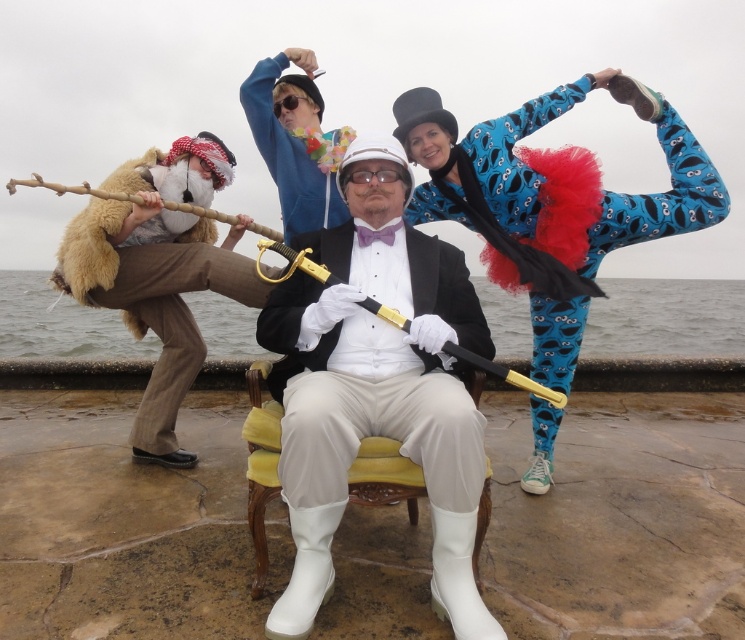
You are a photographer trying to capture both the blue hoodie at upper center and the yellow fabric chair at center in a single frame. Which object should you focus on first if you want to ensure both are in focus, considering their sizes?

The blue hoodie at upper center is thinner than the yellow fabric chair at center, so focusing on the larger yellow fabric chair at center first would help ensure both are in focus.

You are standing at the center of the image and want to find the blue hoodie at upper center. Which direction should you look to locate it?

The blue hoodie at upper center is located at point (297, 140), so you should look towards the upper center direction to find it.

You are a photographer standing at the edge of the scene. You want to take a photo that includes both the blue spandex tights at upper right and the yellow fabric chair at center. What is the minimum distance you need to move backward to ensure both objects are fully visible in your frame?

The blue spandex tights at upper right and yellow fabric chair at center are 4.32 feet apart. To capture both in the frame, you need to move backward at least 4.32 feet to ensure the entire distance between them fits within your camera view.